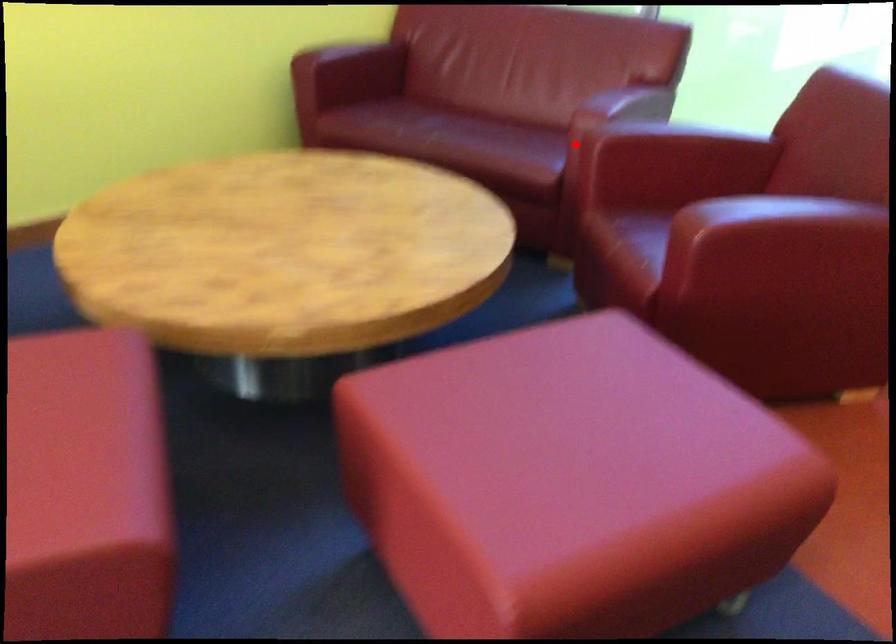
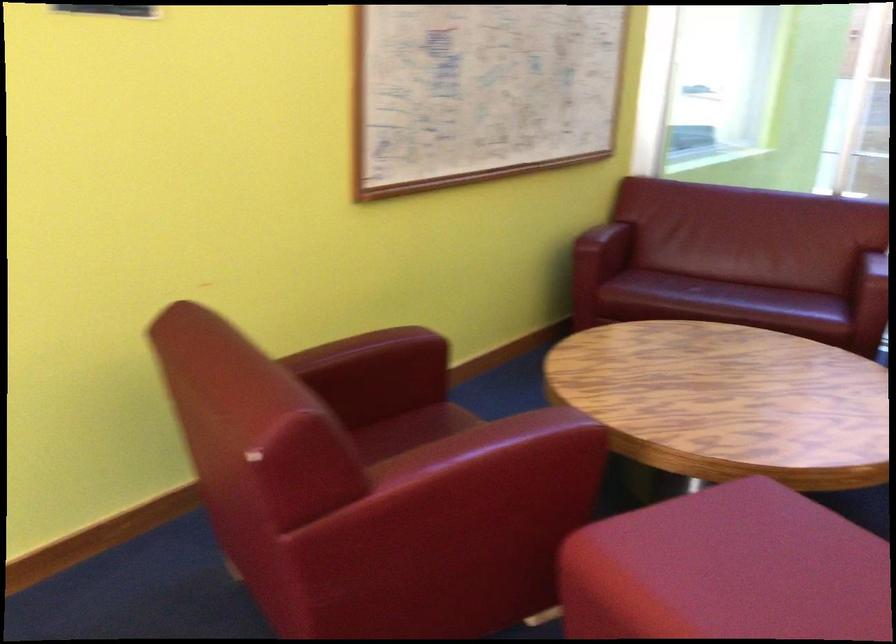
Question: I am providing you with two images of the same scene from different viewpoints. In image1, a red point is highlighted. Considering the same 3D point in image2, which of the following is correct?

Choices:
 (A) It is closer
 (B) It is farther

Answer: (B)